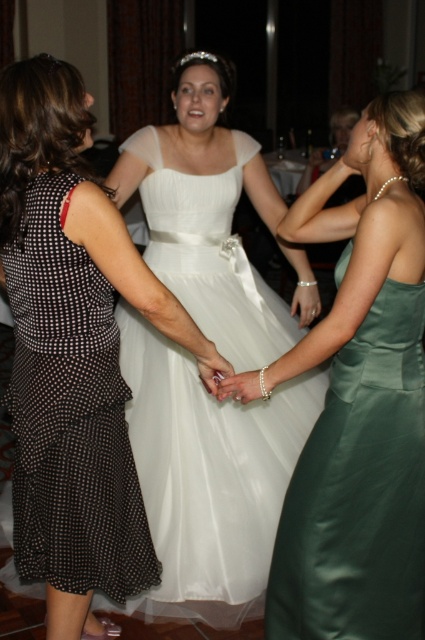
Which of these two, white satin dress at center or white tulle dress at center, stands shorter?

white satin dress at center

Describe the element at coordinates (359, 401) in the screenshot. I see `white satin dress at center` at that location.

Is point (396, 125) in front of point (210, 532)?

That is True.

Locate an element on the screen. white satin dress at center is located at coordinates (359, 401).

Who is positioned more to the right, white tulle dress at center or black dotted fabric dress at left?

white tulle dress at center is more to the right.

Does point (223, 468) lie behind point (22, 403)?

Yes, it is.

Which is in front, point (138, 465) or point (40, 561)?

Point (40, 561) is more forward.

Where is `white tulle dress at center`? This screenshot has height=640, width=425. white tulle dress at center is located at coordinates (209, 476).

Who is positioned more to the left, white satin dress at center or black dotted fabric dress at left?

black dotted fabric dress at left

Who is more distant from viewer, (350, 595) or (93, 513)?

The point (350, 595) is behind.

The height and width of the screenshot is (640, 425). I want to click on white satin dress at center, so point(359,401).

I want to click on white satin dress at center, so click(x=359, y=401).